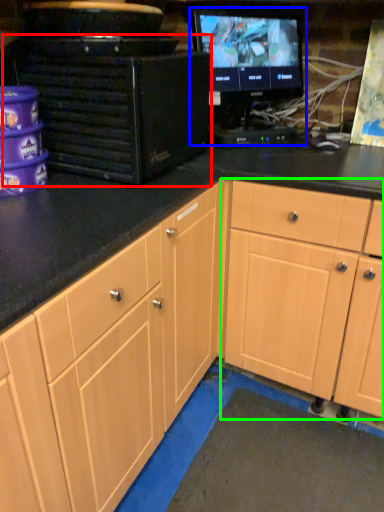
Question: Which object is positioned farthest from desktop computer (highlighted by a red box)? Select from computer monitor (highlighted by a blue box) and cabinetry (highlighted by a green box).

Choices:
 (A) computer monitor
 (B) cabinetry

Answer: (B)